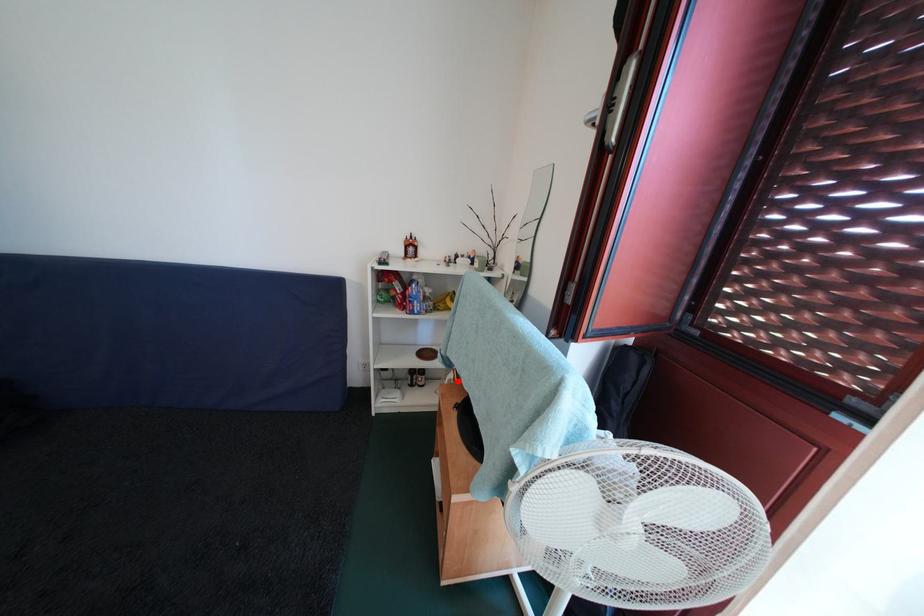
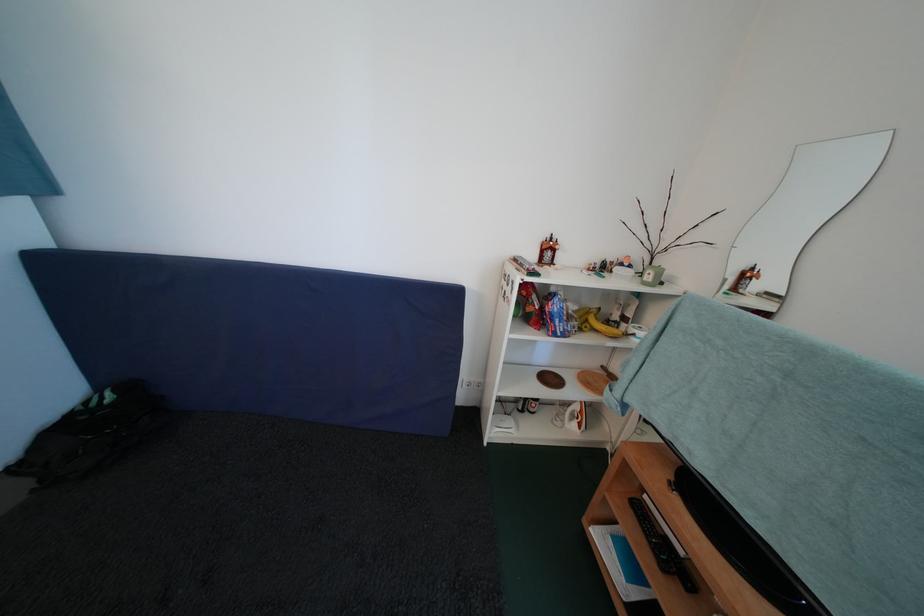
Where in the second image is the point corresponding to the highlighted location from the first image?

(584, 411)